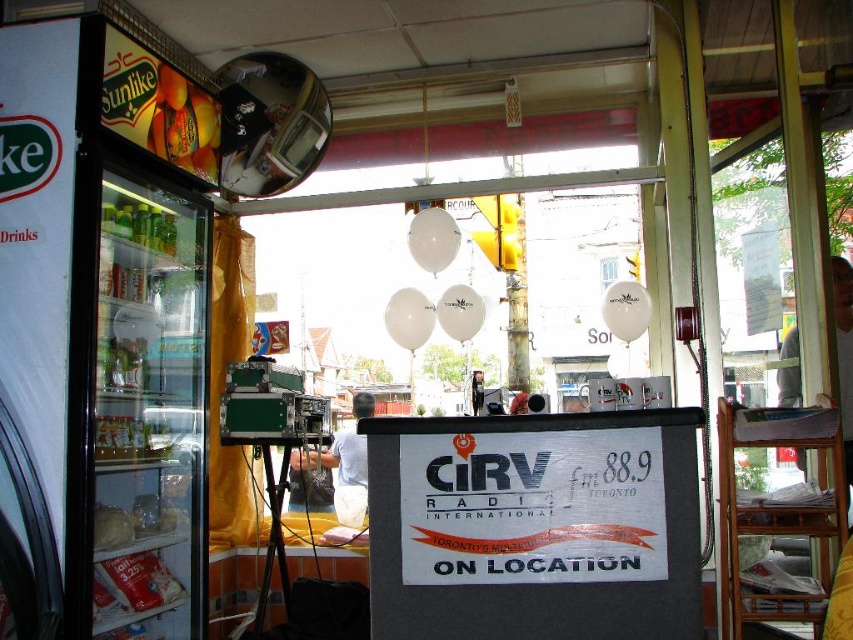
Which is below, shiny plastic oranges at upper left or white fabric shirt at center?

white fabric shirt at center is lower down.

Can you confirm if shiny plastic oranges at upper left is wider than white fabric shirt at center?

In fact, shiny plastic oranges at upper left might be narrower than white fabric shirt at center.

Find the location of `shiny plastic oranges at upper left`. shiny plastic oranges at upper left is located at coordinates (183, 124).